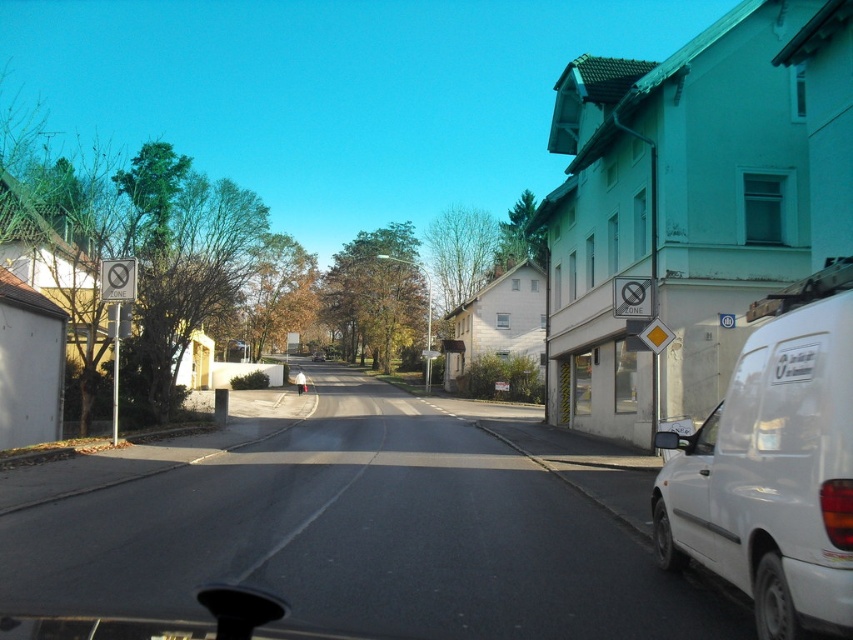
In the scene shown: You are driving a car that is 15 feet long and want to overtake the metallic silver car at center. The white matte van at right is parked on the side of the road. Is there enough space between the van and the metallic silver car to safely make the maneuver?

The distance between the white matte van at right and the metallic silver car at center is 362.05 feet. Since your car is only 15 feet long, there is more than enough space to safely overtake the metallic silver car at center as the distance available is significantly larger than the car length required.

You are driving a car and want to park behind the white matte van at right so that your car is hidden from view from the street. Can you park behind the van if the metallic silver car at center is currently blocking the view?

The white matte van at right is not as tall as the metallic silver car at center, so if the metallic silver car at center is blocking the view, the van is shorter and might not fully hide your car. You might still be visible from the street.

You are driving a car and see two points on the road ahead. The first point is at coordinates point (x=840, y=298) and the second is at point (x=315, y=355). Which point is closer to your car?

Point (x=840, y=298) is closer to the camera than point (x=315, y=355), so the first point is closer to your car.